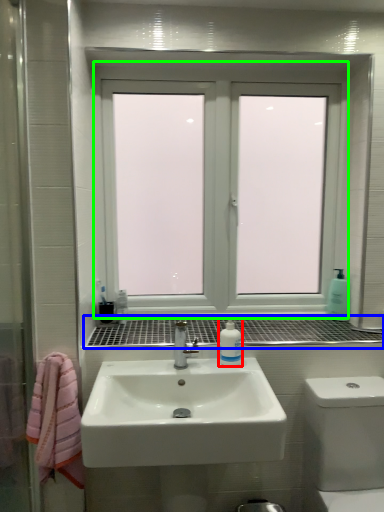
Question: Based on their relative distances, which object is farther from mouthwash (highlighted by a red box)? Choose from window sill (highlighted by a blue box) and window (highlighted by a green box).

Choices:
 (A) window sill
 (B) window

Answer: (B)